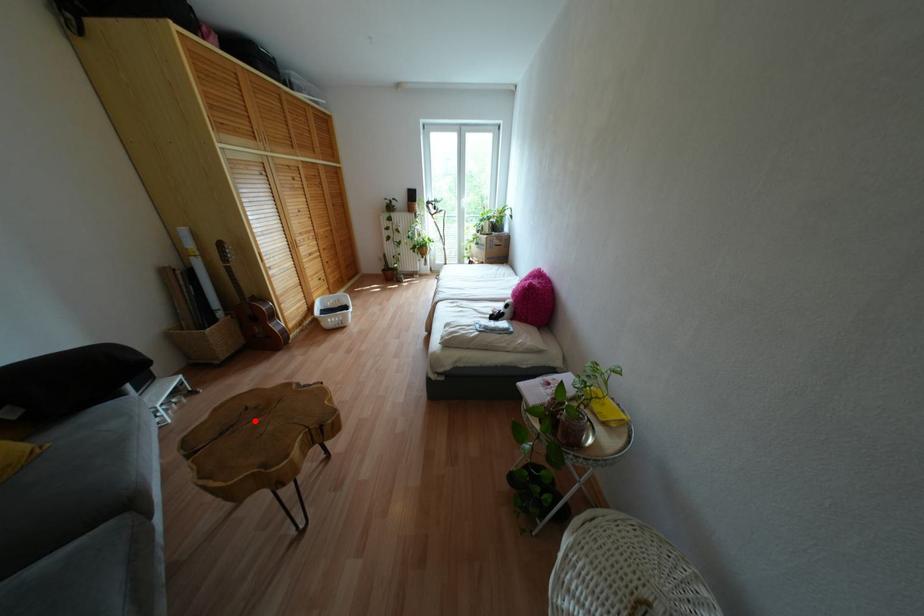
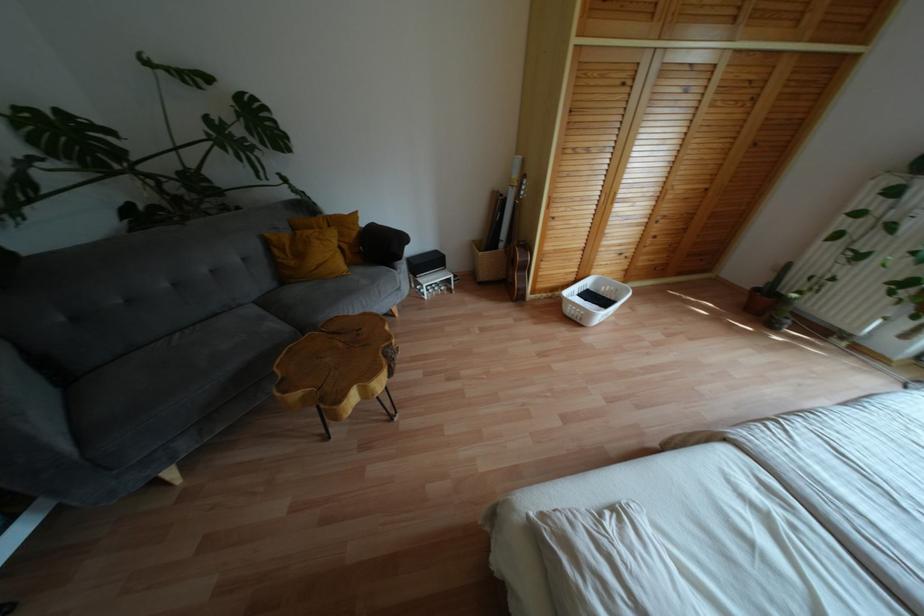
The point at the highlighted location is marked in the first image. Where is the corresponding point in the second image?

(341, 344)